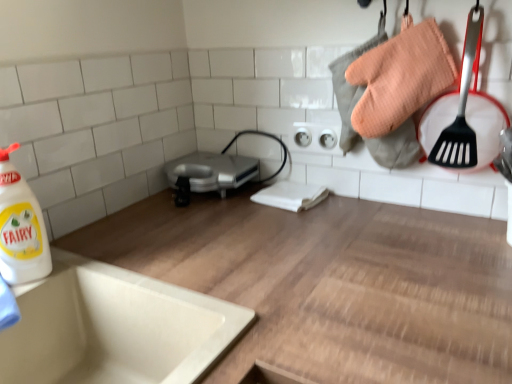
Question: Can you confirm if white glossy bottle at left is shorter than wooden at upper center?

Choices:
 (A) yes
 (B) no

Answer: (A)

Question: From a real-world perspective, is white glossy bottle at left positioned under wooden at upper center based on gravity?

Choices:
 (A) no
 (B) yes

Answer: (A)

Question: From the image's perspective, is white glossy bottle at left located beneath wooden at upper center?

Choices:
 (A) no
 (B) yes

Answer: (A)

Question: Does white glossy bottle at left have a greater height compared to wooden at upper center?

Choices:
 (A) no
 (B) yes

Answer: (A)

Question: Does white glossy bottle at left have a greater width compared to wooden at upper center?

Choices:
 (A) no
 (B) yes

Answer: (A)

Question: Is white glossy bottle at left looking in the opposite direction of wooden at upper center?

Choices:
 (A) no
 (B) yes

Answer: (A)

Question: Can silver metallic toaster at center be found inside white ceramic sink at lower left?

Choices:
 (A) yes
 (B) no

Answer: (B)

Question: Can you confirm if white ceramic sink at lower left is wider than silver metallic toaster at center?

Choices:
 (A) no
 (B) yes

Answer: (B)

Question: Considering the relative positions of white ceramic sink at lower left and silver metallic toaster at center in the image provided, is white ceramic sink at lower left behind silver metallic toaster at center?

Choices:
 (A) no
 (B) yes

Answer: (A)

Question: Does white ceramic sink at lower left turn towards silver metallic toaster at center?

Choices:
 (A) yes
 (B) no

Answer: (B)

Question: From a real-world perspective, is white ceramic sink at lower left positioned under silver metallic toaster at center based on gravity?

Choices:
 (A) no
 (B) yes

Answer: (B)

Question: Considering the relative positions of white ceramic sink at lower left and silver metallic toaster at center in the image provided, is white ceramic sink at lower left to the right of silver metallic toaster at center from the viewer's perspective?

Choices:
 (A) no
 (B) yes

Answer: (A)

Question: Is silver metallic toaster at center to the right of wooden at upper center from the viewer's perspective?

Choices:
 (A) no
 (B) yes

Answer: (A)